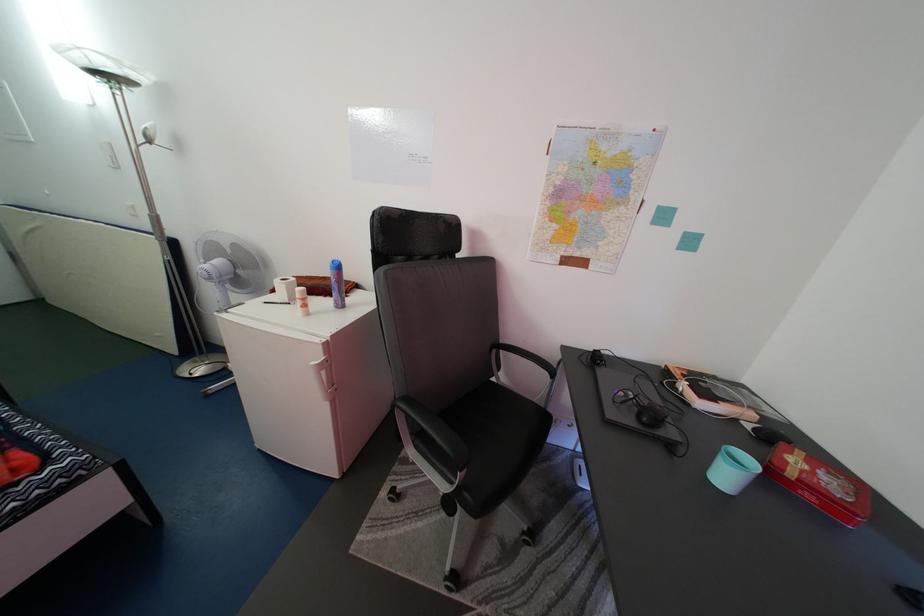
The image size is (924, 616). Identify the location of chair sitting surface. pyautogui.click(x=499, y=422).